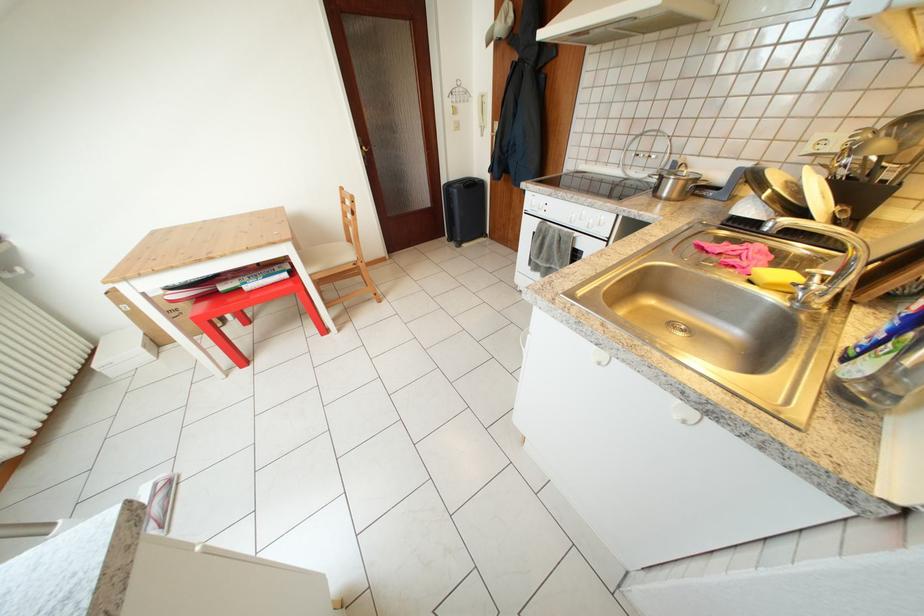
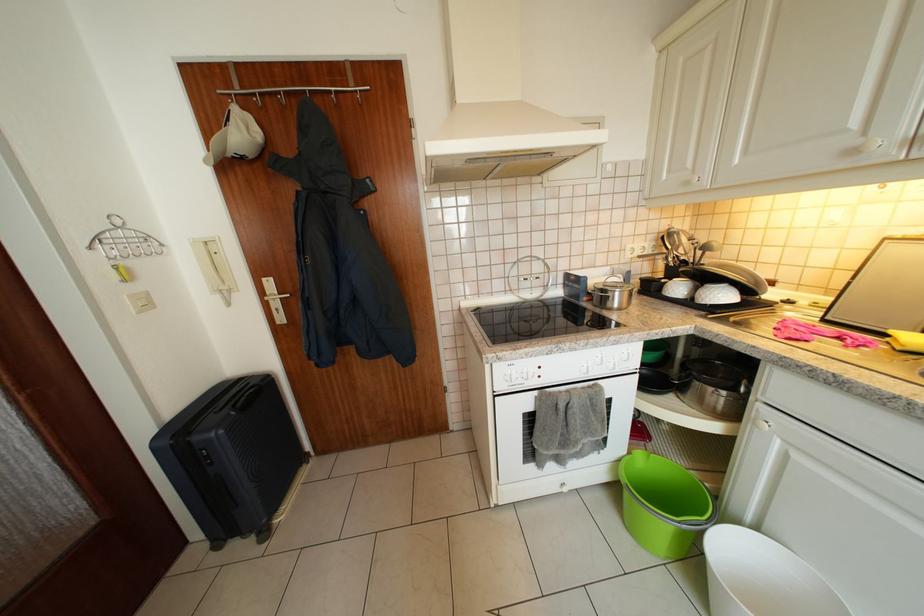
In the second image, find the point that corresponds to (502,137) in the first image.

(271, 299)